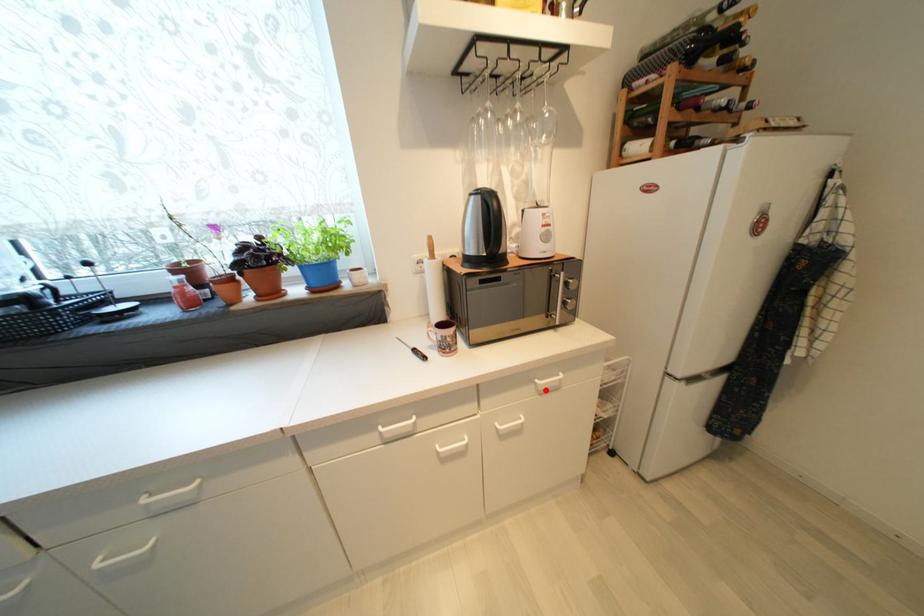
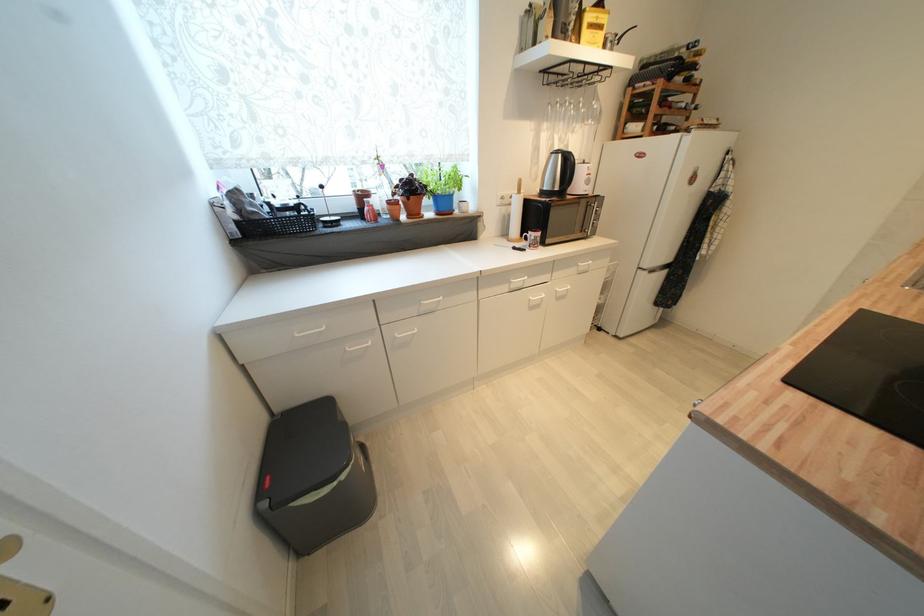
Find the pixel in the second image that matches the highlighted location in the first image.

(585, 270)